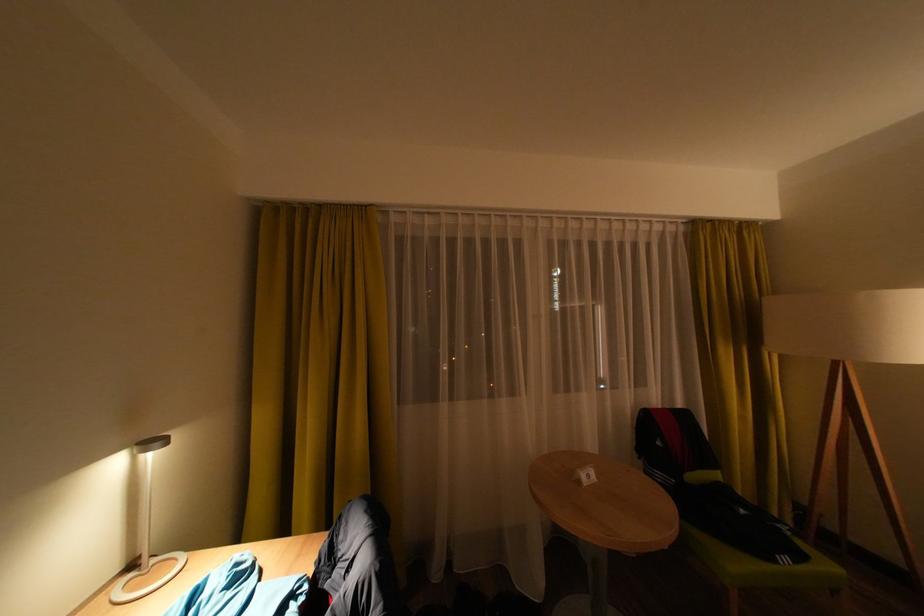
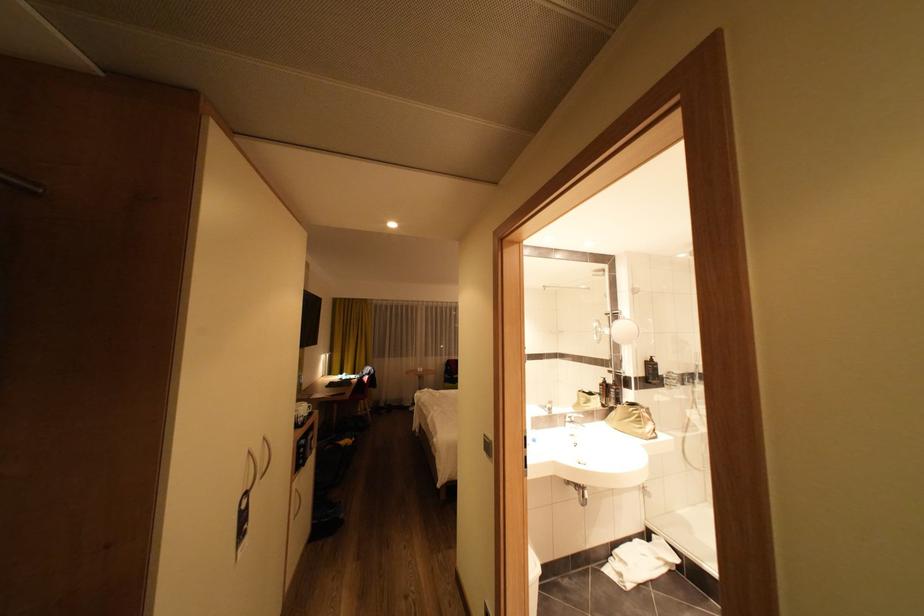
Question: In a continuous first-person perspective shot, in which direction is the camera moving?

Choices:
 (A) Left
 (B) Right
 (C) Forward
 (D) Backward

Answer: (D)